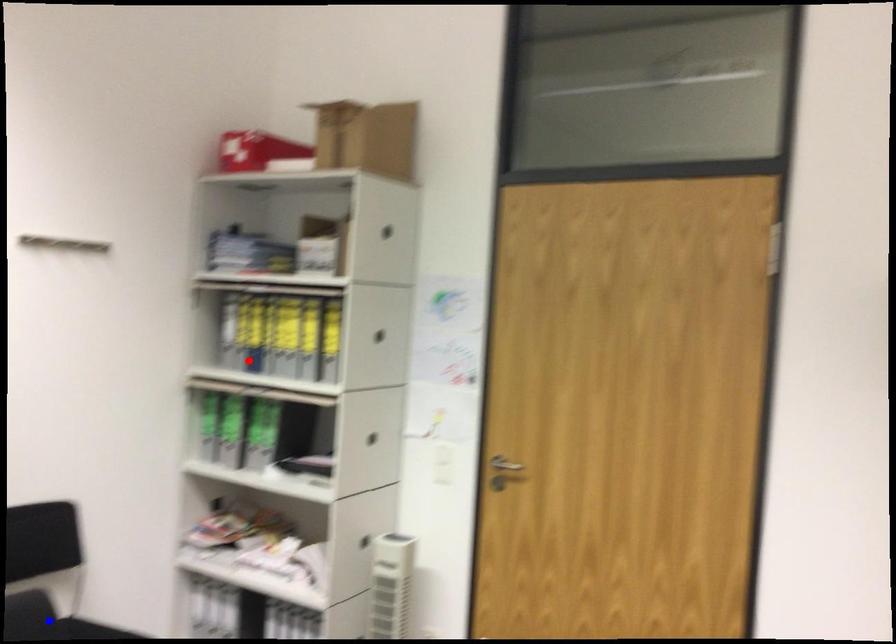
Question: In the image, two points are highlighted. Which point is nearer to the camera? Reply with the corresponding letter.

Choices:
 (A) blue point
 (B) red point

Answer: (A)